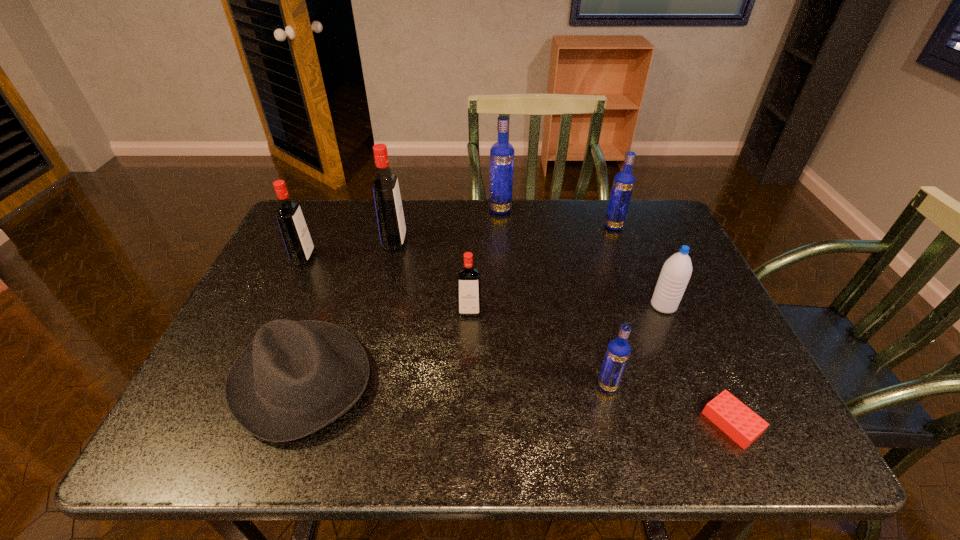
Image resolution: width=960 pixels, height=540 pixels. What are the coordinates of `the farthest vodka` in the screenshot? It's located at (501, 153).

I want to click on the biggest blue vodka, so click(x=501, y=153).

The height and width of the screenshot is (540, 960). Find the location of `the second vodka from left to right`. the second vodka from left to right is located at coordinates (391, 224).

This screenshot has width=960, height=540. What are the coordinates of `the second red vodka from right to left` in the screenshot? It's located at (391, 224).

What are the coordinates of `the second farthest blue vodka` in the screenshot? It's located at (623, 183).

Where is `the rightmost vodka`? Image resolution: width=960 pixels, height=540 pixels. the rightmost vodka is located at coordinates (623, 183).

The height and width of the screenshot is (540, 960). I want to click on the leftmost red vodka, so (x=296, y=236).

The width and height of the screenshot is (960, 540). In order to click on the leftmost vodka in this screenshot , I will do `click(296, 236)`.

This screenshot has height=540, width=960. In order to click on blue water bottle in this screenshot , I will do `click(676, 272)`.

Image resolution: width=960 pixels, height=540 pixels. What are the coordinates of `the sixth object from left to right` in the screenshot? It's located at (618, 351).